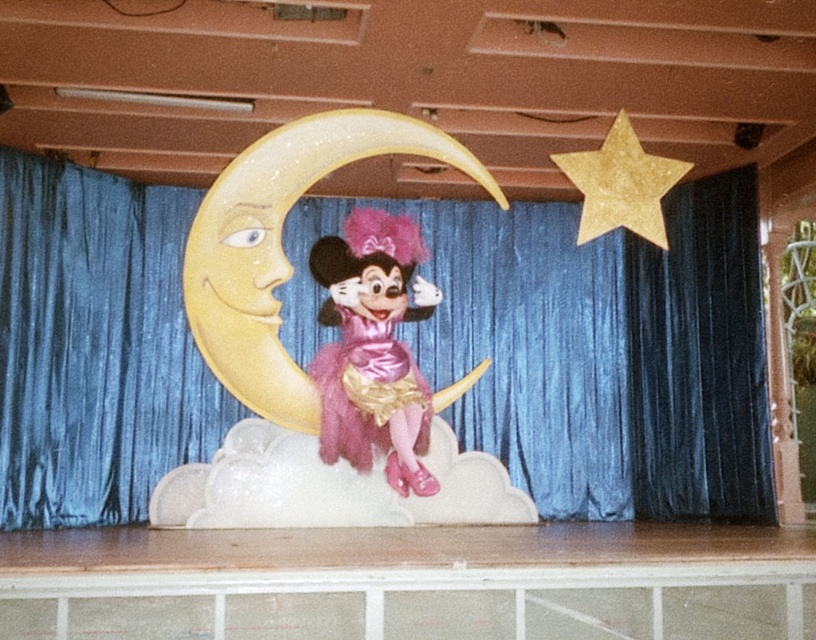
Question: Is velvet blue curtain at center smaller than pink satin doll at center?

Choices:
 (A) yes
 (B) no

Answer: (B)

Question: Is wooden stage at center below gold glitter star at upper right?

Choices:
 (A) yes
 (B) no

Answer: (A)

Question: Which object appears farthest from the camera in this image?

Choices:
 (A) gold glitter star at upper right
 (B) wooden stage at center

Answer: (B)

Question: Does pink satin doll at center have a larger size compared to gold glitter star at upper right?

Choices:
 (A) yes
 (B) no

Answer: (A)

Question: Considering the real-world distances, which object is farthest from the velvet blue curtain at center?

Choices:
 (A) pink satin doll at center
 (B) gold glitter star at upper right
 (C) wooden stage at center

Answer: (B)

Question: Considering the real-world distances, which object is farthest from the gold glitter star at upper right?

Choices:
 (A) pink satin doll at center
 (B) wooden stage at center
 (C) velvet blue curtain at center

Answer: (C)